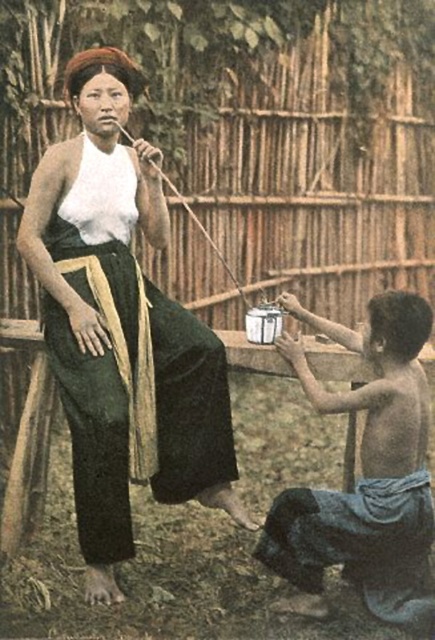
Is matte white blouse at upper left above smooth wooden pot at lower right?

Yes.

Which is more to the right, matte white blouse at upper left or smooth wooden pot at lower right?

From the viewer's perspective, smooth wooden pot at lower right appears more on the right side.

This screenshot has height=640, width=435. What are the coordinates of `matte white blouse at upper left` in the screenshot? It's located at (120, 324).